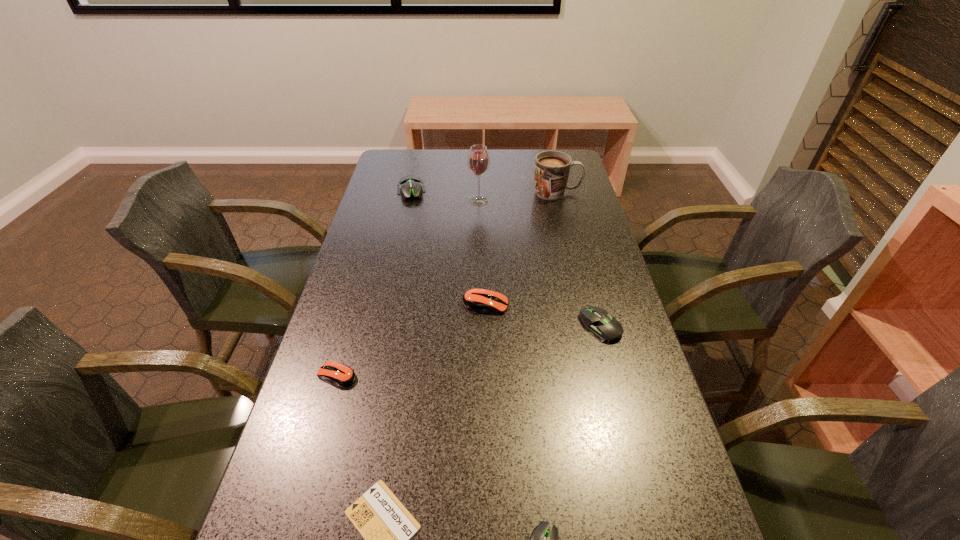
Locate an element on the screen. gray computer mouse that stands as the second closest to the red wineglass is located at coordinates (603, 327).

Identify the location of free space that satisfies the following two spatial constraints: 1. on the front side of the biggest gray computer mouse; 2. on the left side of the right orange computer mouse. (386, 305).